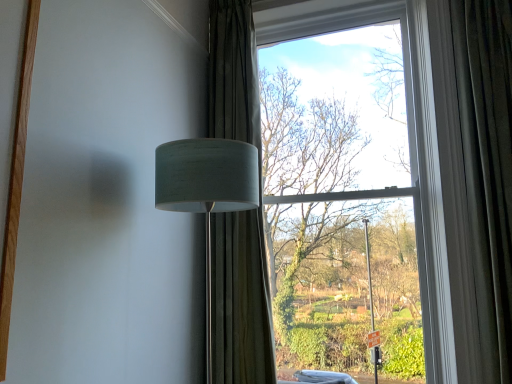
Question: From a real-world perspective, is velvet dark green curtain at right, which is the first curtain from right to left, positioned above or below green textured curtain at center, marked as the 1th curtain in a left-to-right arrangement?

Choices:
 (A) below
 (B) above

Answer: (A)

Question: Is velvet dark green curtain at right, which appears as the 2th curtain when viewed from the left, spatially inside green textured curtain at center, the 2th curtain viewed from the right, or outside of it?

Choices:
 (A) inside
 (B) outside

Answer: (B)

Question: Considering the real-world distances, which object is farthest from the velvet dark green curtain at right, which appears as the 2th curtain when viewed from the left?

Choices:
 (A) green textured curtain at center, marked as the 1th curtain in a left-to-right arrangement
 (B) clear glass window at center
 (C) white fabric lampshade at left

Answer: (C)

Question: Based on their relative distances, which object is nearer to the white fabric lampshade at left?

Choices:
 (A) green textured curtain at center, the 2th curtain viewed from the right
 (B) clear glass window at center
 (C) velvet dark green curtain at right, which appears as the 2th curtain when viewed from the left

Answer: (A)